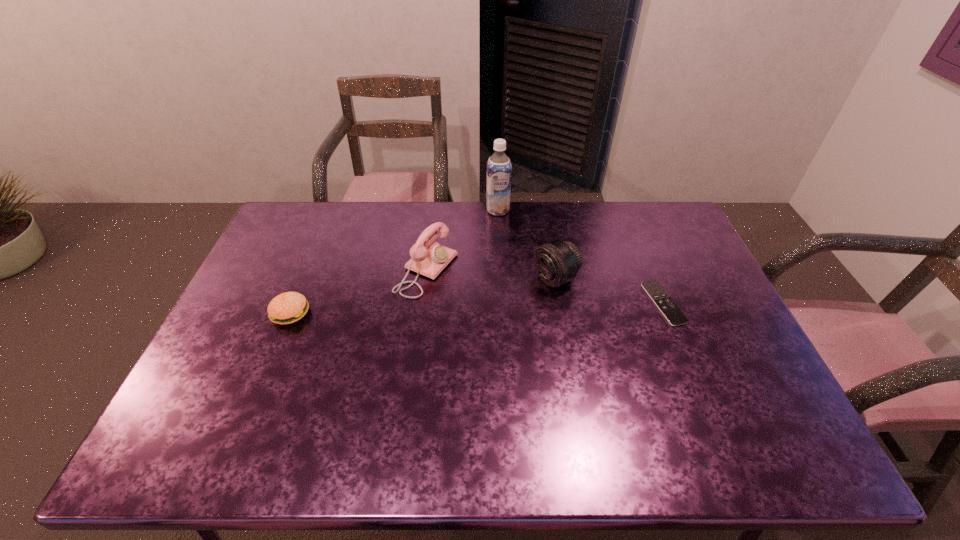
You are a GUI agent. You are given a task and a screenshot of the screen. Output one action in this format:
    pyautogui.click(x=<x>, y=<y>)
    Task: Click on the fourth tallest object
    The width and height of the screenshot is (960, 540).
    Given the screenshot: What is the action you would take?
    pyautogui.click(x=289, y=307)

The width and height of the screenshot is (960, 540). I want to click on patty, so (x=289, y=307).

I want to click on the shortest object, so click(x=675, y=317).

You are a GUI agent. You are given a task and a screenshot of the screen. Output one action in this format:
    pyautogui.click(x=<x>, y=<y>)
    Task: Click on the remote control
    The image size is (960, 540).
    Given the screenshot: What is the action you would take?
    pyautogui.click(x=675, y=317)

The image size is (960, 540). In order to click on the tallest object in this screenshot , I will do `click(499, 169)`.

Where is `the third object from left to right`? Image resolution: width=960 pixels, height=540 pixels. the third object from left to right is located at coordinates (499, 169).

You are a GUI agent. You are given a task and a screenshot of the screen. Output one action in this format:
    pyautogui.click(x=<x>, y=<y>)
    Task: Click on the second object from right to left
    The image size is (960, 540).
    Given the screenshot: What is the action you would take?
    pyautogui.click(x=557, y=262)

You are a GUI agent. You are given a task and a screenshot of the screen. Output one action in this format:
    pyautogui.click(x=<x>, y=<y>)
    Task: Click on the telephone
    
    Given the screenshot: What is the action you would take?
    pyautogui.click(x=428, y=257)

Find the location of a particular element. vacant space situated 0.270m on the front of the leftmost object is located at coordinates (249, 416).

You are a GUI agent. You are given a task and a screenshot of the screen. Output one action in this format:
    pyautogui.click(x=<x>, y=<y>)
    Task: Click on the vacant region located 0.150m on the front of the shortest object
    The image size is (960, 540).
    Given the screenshot: What is the action you would take?
    pyautogui.click(x=691, y=372)